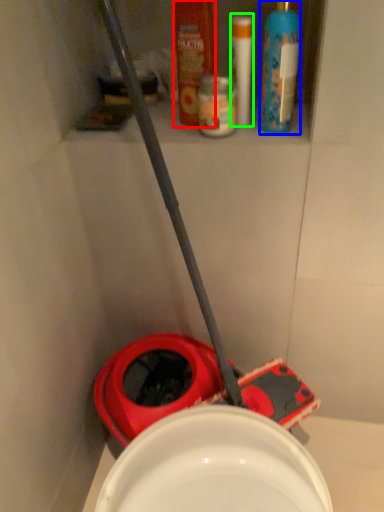
Question: Estimate the real-world distances between objects in this image. Which object is closer to mouthwash (highlighted by a red box), cleaning product (highlighted by a blue box) or toiletry (highlighted by a green box)?

Choices:
 (A) cleaning product
 (B) toiletry

Answer: (B)